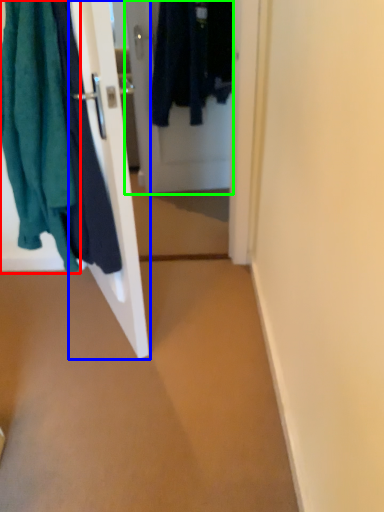
Question: Based on their relative distances, which object is farther from towel (highlighted by a red box)? Choose from door (highlighted by a blue box) and door (highlighted by a green box).

Choices:
 (A) door
 (B) door

Answer: (B)